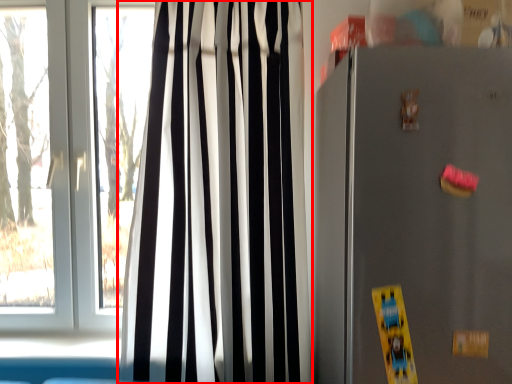
Question: From the image's perspective, where is curtain (annotated by the red box) located in relation to appliance in the image?

Choices:
 (A) below
 (B) above

Answer: (B)